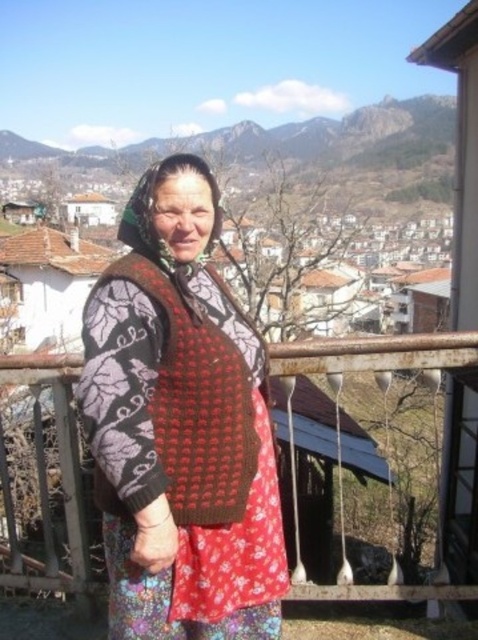
Question: From the image, what is the correct spatial relationship of knitted sweater at center in relation to green textured mountain at upper center?

Choices:
 (A) left
 (B) right

Answer: (B)

Question: Estimate the real-world distances between objects in this image. Which object is farther from the green textured mountain at upper center?

Choices:
 (A) rusty metal railing at center
 (B) knitted sweater at center
 (C) knitted wool shawl at center

Answer: (B)

Question: Can you confirm if knitted sweater at center is wider than knitted wool shawl at center?

Choices:
 (A) no
 (B) yes

Answer: (B)

Question: Which object appears closest to the camera in this image?

Choices:
 (A) rusty metal railing at center
 (B) knitted wool shawl at center
 (C) knitted sweater at center

Answer: (B)

Question: Is knitted wool shawl at center smaller than rusty metal railing at center?

Choices:
 (A) no
 (B) yes

Answer: (B)

Question: Which point is closer to the camera?

Choices:
 (A) knitted wool shawl at center
 (B) green textured mountain at upper center

Answer: (A)